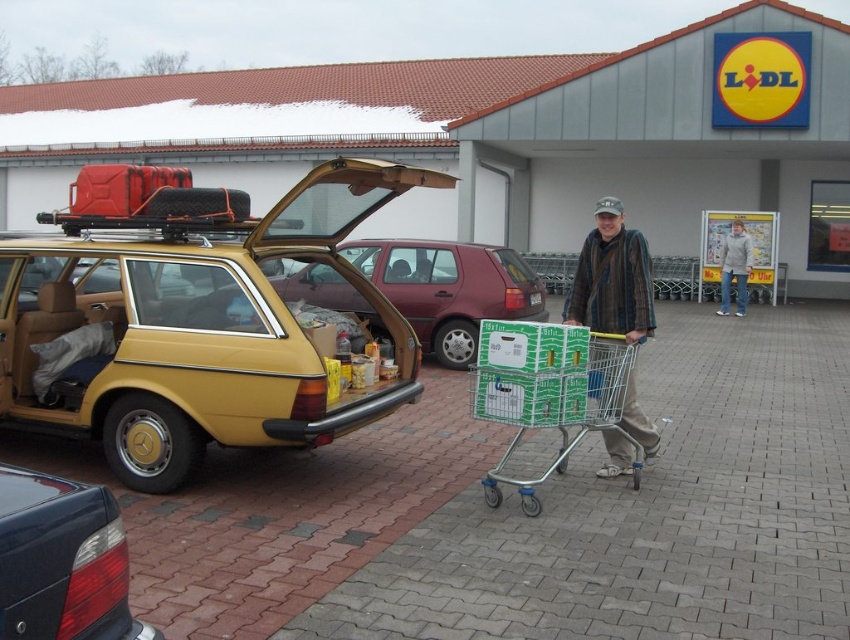
Which is more to the right, gold metallic station wagon at center or metallic red minivan at center?

Positioned to the right is metallic red minivan at center.

Consider the image. Who is positioned more to the left, gold metallic station wagon at center or metallic red minivan at center?

From the viewer's perspective, gold metallic station wagon at center appears more on the left side.

Where is `gold metallic station wagon at center`? The height and width of the screenshot is (640, 850). gold metallic station wagon at center is located at coordinates [x=197, y=317].

This screenshot has width=850, height=640. In order to click on gold metallic station wagon at center in this screenshot , I will do `click(197, 317)`.

Does gold metallic station wagon at center appear on the left side of metallic silver shopping cart at center?

Indeed, gold metallic station wagon at center is positioned on the left side of metallic silver shopping cart at center.

Is gold metallic station wagon at center smaller than metallic silver shopping cart at center?

Yes.

Which is behind, point (313, 332) or point (524, 490)?

Point (313, 332)

Identify the location of gold metallic station wagon at center. The width and height of the screenshot is (850, 640). (197, 317).

Is shiny black tail light at lower left wider than gray woolen sweater at center?

No.

Which is behind, point (4, 630) or point (740, 310)?

The point (740, 310) is more distant.

This screenshot has height=640, width=850. In order to click on shiny black tail light at lower left in this screenshot , I will do `click(61, 561)`.